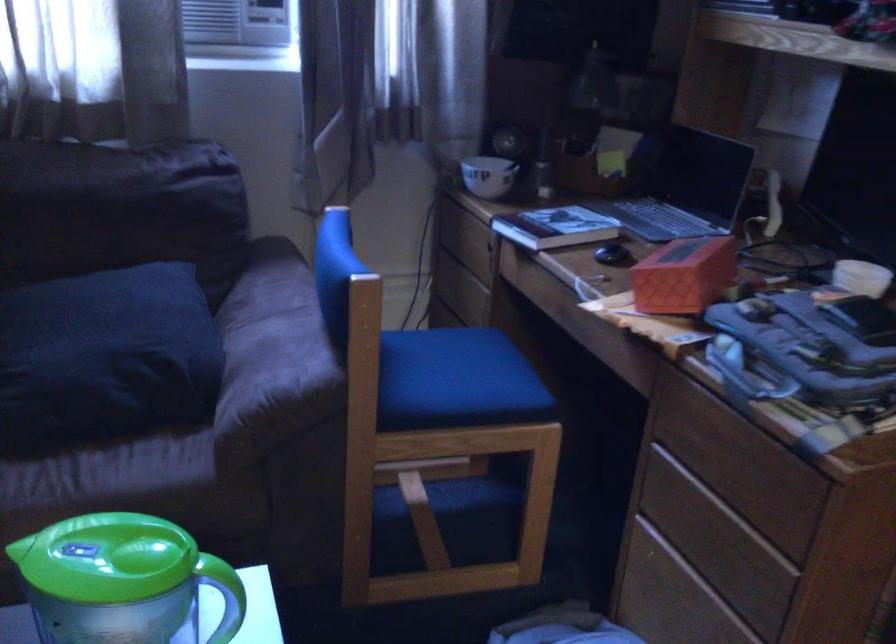
At what (x,y) coordinates should I click in order to perform the action: click on green pitcher lid. Please return your answer as a coordinate pair (x, y). The height and width of the screenshot is (644, 896). Looking at the image, I should click on (106, 558).